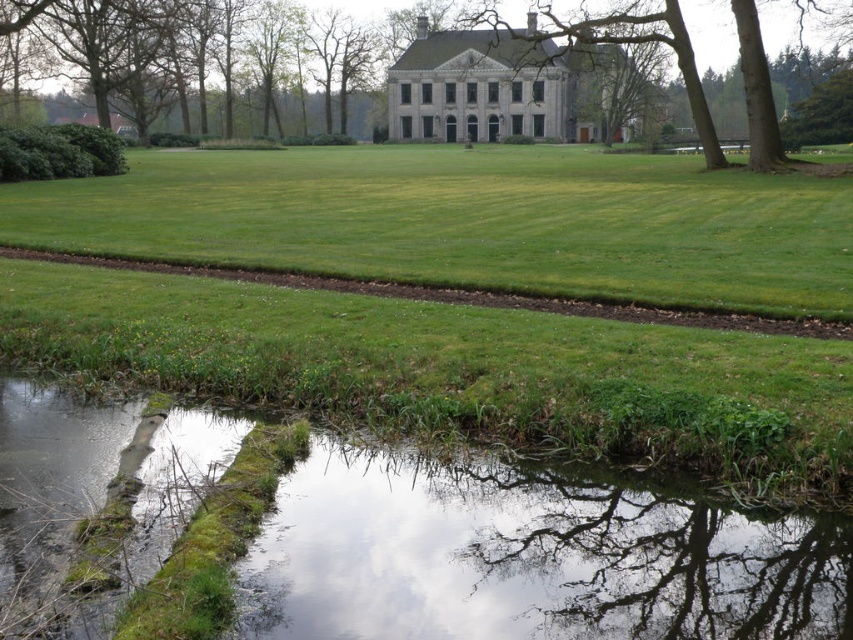
You are standing in front of the mansion and want to reach the point marked as point (x=424, y=209). Can you estimate how far you need to walk to reach that point?

The point (x=424, y=209) is 85.86 feet away from the viewer, so you need to walk approximately 85.86 feet to reach it.

You are standing in front of the mansion and want to take a photo of both point (x=234, y=168) and point (x=755, y=45). Which point should you focus on first to ensure both are in sharp focus?

You should focus on point (x=234, y=168) first because it is closer to you than point (x=755, y=45). This ensures the closer point is in focus, and the farther point will also be within the depth of field.

You are standing at the point marked by coordinates point [469,220] in the image. What is the color of the ground beneath your feet?

The point [469,220] marks green grass at lower center, so the ground beneath your feet is green grass.